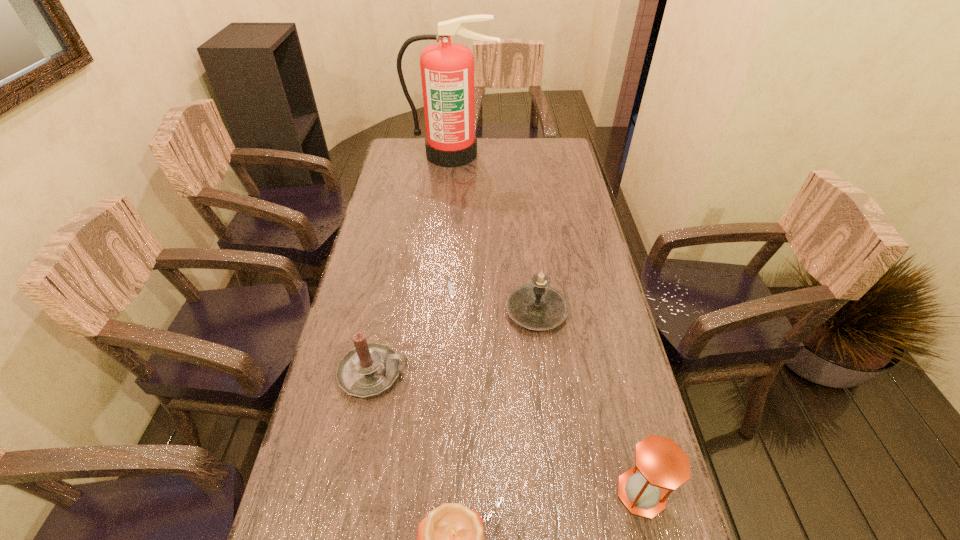
Locate an element on the screen. The image size is (960, 540). the tallest object is located at coordinates (447, 69).

The height and width of the screenshot is (540, 960). I want to click on the farthest object, so (x=447, y=69).

Where is `the farthest candle`? Image resolution: width=960 pixels, height=540 pixels. the farthest candle is located at coordinates (537, 306).

You are a GUI agent. You are given a task and a screenshot of the screen. Output one action in this format:
    pyautogui.click(x=<x>, y=<y>)
    Task: Click on the rightmost candle
    The height and width of the screenshot is (540, 960).
    Given the screenshot: What is the action you would take?
    pyautogui.click(x=537, y=306)

This screenshot has height=540, width=960. What are the coordinates of `the second farthest candle` in the screenshot? It's located at (369, 369).

Where is `the third farthest object`? This screenshot has width=960, height=540. the third farthest object is located at coordinates (369, 369).

Locate an element on the screen. The width and height of the screenshot is (960, 540). the rightmost object is located at coordinates (660, 464).

Find the location of a particular element. This screenshot has height=540, width=960. free point located at the nozzle of the tallest object is located at coordinates (447, 208).

Locate an element on the screen. The image size is (960, 540). vacant region located on the back of the fourth nearest object is located at coordinates (525, 213).

Locate an element on the screen. This screenshot has width=960, height=540. free space located on the side of the third farthest object with the handle loop is located at coordinates (496, 373).